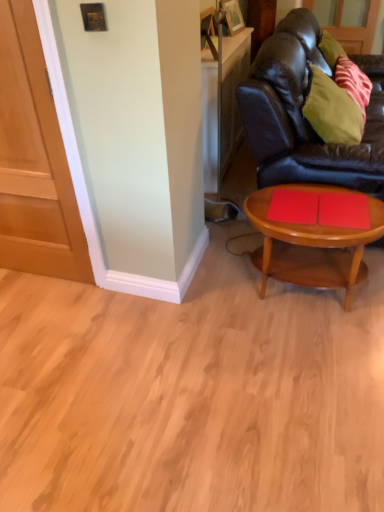
Question: Is green fabric pillow at upper right oriented towards wooden coffee table at lower right?

Choices:
 (A) yes
 (B) no

Answer: (B)

Question: Considering the relative sizes of green fabric pillow at upper right and wooden coffee table at lower right in the image provided, is green fabric pillow at upper right taller than wooden coffee table at lower right?

Choices:
 (A) no
 (B) yes

Answer: (A)

Question: From a real-world perspective, is green fabric pillow at upper right positioned over wooden coffee table at lower right based on gravity?

Choices:
 (A) no
 (B) yes

Answer: (B)

Question: From the image's perspective, is green fabric pillow at upper right above wooden coffee table at lower right?

Choices:
 (A) yes
 (B) no

Answer: (A)

Question: Considering the relative positions of green fabric pillow at upper right and wooden coffee table at lower right in the image provided, is green fabric pillow at upper right behind wooden coffee table at lower right?

Choices:
 (A) yes
 (B) no

Answer: (A)

Question: Is green fabric pillow at upper right positioned far away from wooden coffee table at lower right?

Choices:
 (A) yes
 (B) no

Answer: (B)

Question: Is green fabric pillow at upper right smaller than black leather couch at right?

Choices:
 (A) yes
 (B) no

Answer: (A)

Question: Is green fabric pillow at upper right positioned with its back to black leather couch at right?

Choices:
 (A) yes
 (B) no

Answer: (A)

Question: Is green fabric pillow at upper right aimed at black leather couch at right?

Choices:
 (A) yes
 (B) no

Answer: (A)

Question: From a real-world perspective, is green fabric pillow at upper right below black leather couch at right?

Choices:
 (A) no
 (B) yes

Answer: (A)

Question: Can you confirm if green fabric pillow at upper right is shorter than black leather couch at right?

Choices:
 (A) yes
 (B) no

Answer: (A)

Question: Is green fabric pillow at upper right further to camera compared to black leather couch at right?

Choices:
 (A) no
 (B) yes

Answer: (B)

Question: Is matte wood door at left next to green fabric pillow at upper right?

Choices:
 (A) no
 (B) yes

Answer: (A)